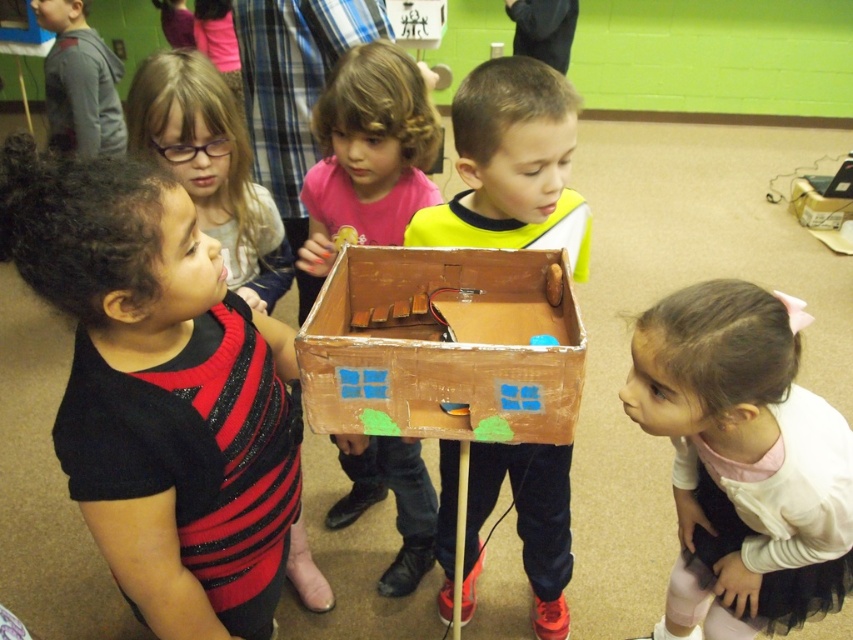
You are a photographer trying to capture a closeup of the matte cardboard box at center and the black glitter dress at left in the same frame. Given that your camera can only focus on objects within 20 centimeters of each other, will you be able to take the photo?

The matte cardboard box at center and black glitter dress at left are 19.26 centimeters apart from each other, so yes, the camera can focus on both objects since their distance is within the 20 centimeter limit.

Based on the photo, you are a photographer setting up a shoot in this room. You want to position a light to the left of the matte cardboard box at center and to the right of the black glitter dress at left. Is this possible given their positions?

The matte cardboard box at center is to the right of the black glitter dress at left, so placing a light to the left of the matte cardboard box at center and to the right of the black glitter dress at left is possible between them.